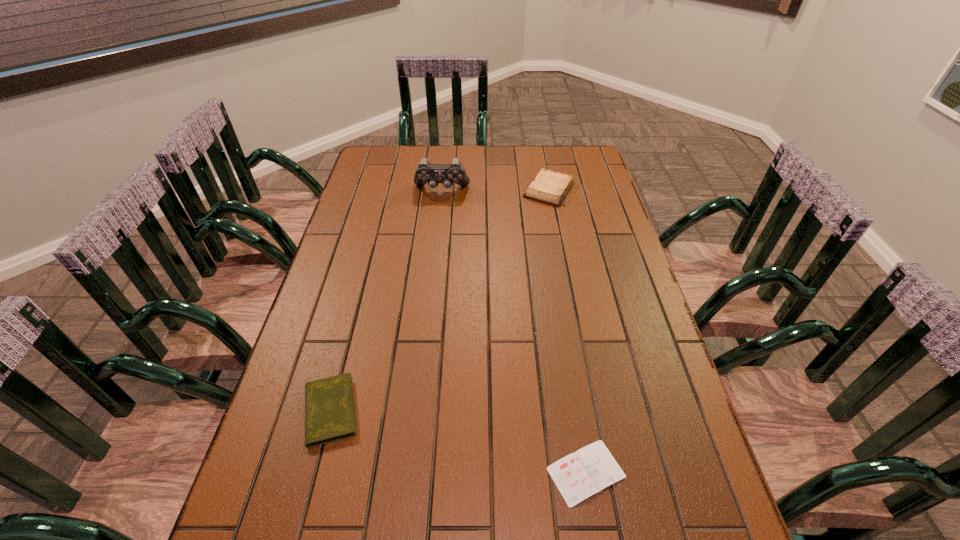
Locate an element on the screen. This screenshot has width=960, height=540. vacant space that is in between the shortest diary and the second tallest diary is located at coordinates (458, 442).

You are a GUI agent. You are given a task and a screenshot of the screen. Output one action in this format:
    pyautogui.click(x=<x>, y=<y>)
    Task: Click on the empty space between the second tallest diary and the third object from right to left
    
    Given the screenshot: What is the action you would take?
    pos(386,300)

Where is `vacant space that's between the leftmost object and the shortest diary`? Image resolution: width=960 pixels, height=540 pixels. vacant space that's between the leftmost object and the shortest diary is located at coordinates (x=458, y=442).

Where is `free space between the third shortest object and the second object from left to right`? The width and height of the screenshot is (960, 540). free space between the third shortest object and the second object from left to right is located at coordinates (495, 190).

The image size is (960, 540). What are the coordinates of `vacant area between the second tallest object and the second tallest diary` in the screenshot? It's located at (440, 300).

The height and width of the screenshot is (540, 960). In order to click on vacant point located between the shortest diary and the tallest object in this screenshot , I will do `click(514, 332)`.

Image resolution: width=960 pixels, height=540 pixels. In order to click on blank region between the leftmost diary and the third object from right to left in this screenshot , I will do `click(386, 300)`.

You are a GUI agent. You are given a task and a screenshot of the screen. Output one action in this format:
    pyautogui.click(x=<x>, y=<y>)
    Task: Click on the blank region between the control and the shortest diary
    
    Given the screenshot: What is the action you would take?
    pyautogui.click(x=514, y=332)

Image resolution: width=960 pixels, height=540 pixels. Identify the location of empty location between the second object from left to right and the shortest object. (514, 332).

Locate an element on the screen. Image resolution: width=960 pixels, height=540 pixels. object that stands as the second closest to the leftmost object is located at coordinates click(425, 173).